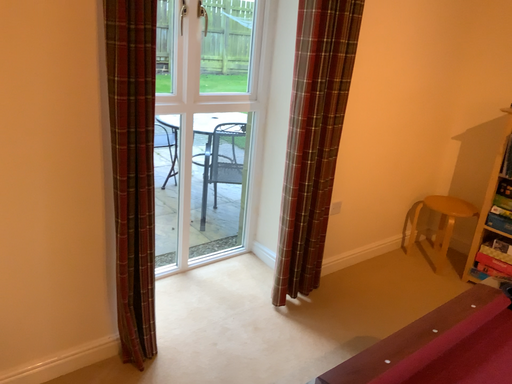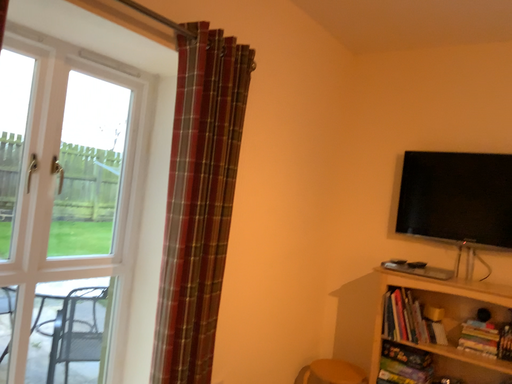
Question: How did the camera likely rotate when shooting the video?

Choices:
 (A) rotated right
 (B) rotated left

Answer: (A)